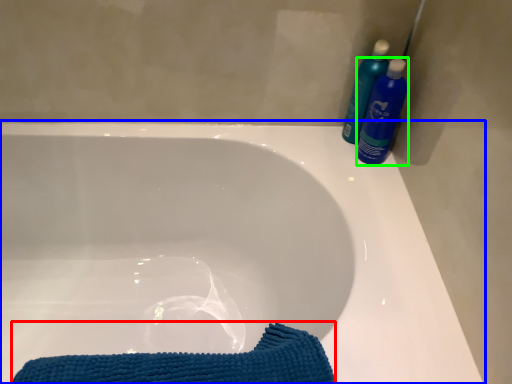
Question: Which object is positioned closest to beach towel (highlighted by a red box)? Select from bathtub (highlighted by a blue box) and cleaning product (highlighted by a green box).

Choices:
 (A) bathtub
 (B) cleaning product

Answer: (A)